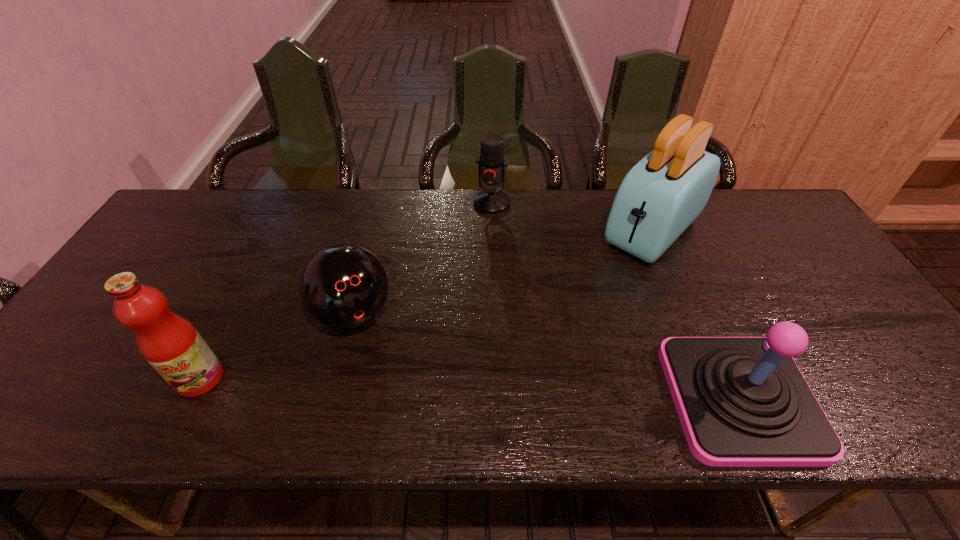
The width and height of the screenshot is (960, 540). What are the coordinates of `unoccupied area between the joystick and the microphone` in the screenshot? It's located at (615, 301).

This screenshot has width=960, height=540. Identify the location of free spot between the third object from left to right and the fourth object from right to left. (422, 258).

The image size is (960, 540). I want to click on object that is the fourth closest to the second object from left to right, so click(742, 401).

Identify the location of the closest object relative to the fourth object from right to left. The image size is (960, 540). (170, 344).

Locate an element on the screen. Image resolution: width=960 pixels, height=540 pixels. free spot that satisfies the following two spatial constraints: 1. on the front label of the leftmost object; 2. forward from the base of the joystick is located at coordinates (190, 399).

Find the location of a particular element. The image size is (960, 540). vacant position in the image that satisfies the following two spatial constraints: 1. on the front side of the toaster; 2. forward from the base of the joystick is located at coordinates [721, 399].

The width and height of the screenshot is (960, 540). Find the location of `free space that satisfies the following two spatial constraints: 1. on the front side of the third object from right to left; 2. forward from the base of the joystick`. free space that satisfies the following two spatial constraints: 1. on the front side of the third object from right to left; 2. forward from the base of the joystick is located at coordinates (497, 399).

Where is `blank area in the image that satisfies the following two spatial constraints: 1. on the front side of the toaster; 2. forward from the base of the joystick`? Image resolution: width=960 pixels, height=540 pixels. blank area in the image that satisfies the following two spatial constraints: 1. on the front side of the toaster; 2. forward from the base of the joystick is located at coordinates (721, 399).

Find the location of `vacant area that satisfies the following two spatial constraints: 1. on the front label of the joystick; 2. forward from the base of the leftmost object`. vacant area that satisfies the following two spatial constraints: 1. on the front label of the joystick; 2. forward from the base of the leftmost object is located at coordinates (190, 399).

At what (x,y) coordinates should I click in order to perform the action: click on blank area in the image that satisfies the following two spatial constraints: 1. on the back side of the microphone; 2. on the right side of the second object from left to right. Please return your answer as a coordinate pair (x, y). This screenshot has width=960, height=540. Looking at the image, I should click on (382, 203).